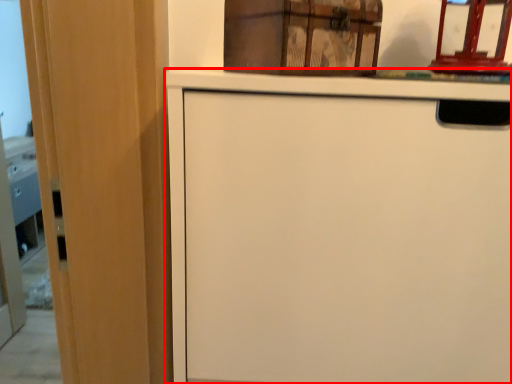
Question: Where is cabinetry (annotated by the red box) located in relation to cabinetry in the image?

Choices:
 (A) right
 (B) left

Answer: (A)